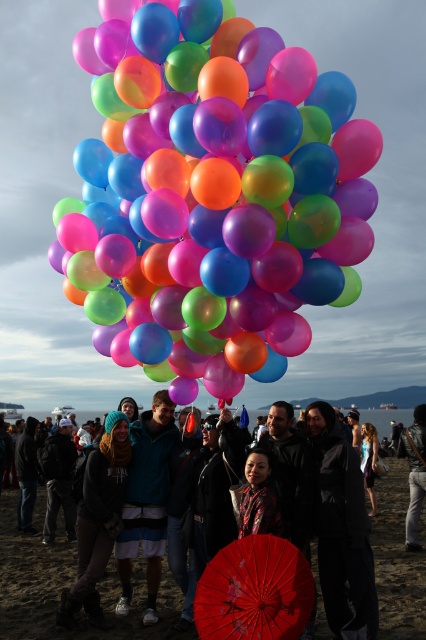
Question: Does red glossy umbrella at center come behind denim jacket at lower right?

Choices:
 (A) no
 (B) yes

Answer: (A)

Question: Which point is closer to the camera?

Choices:
 (A) denim jacket at lower right
 (B) red paper umbrella at center
 (C) matte black hoodie at center
 (D) red glossy umbrella at center

Answer: (D)

Question: Does black waterproof jacket at center appear on the left side of red glossy umbrella at center?

Choices:
 (A) yes
 (B) no

Answer: (B)

Question: Which object is closer to the camera taking this photo?

Choices:
 (A) translucent glossy balloons at center
 (B) denim jacket at lower right

Answer: (A)

Question: Does red glossy umbrella at center appear on the left side of matte black hoodie at center?

Choices:
 (A) no
 (B) yes

Answer: (A)

Question: Estimate the real-world distances between objects in this image. Which object is farther from the translucent glossy balloons at center?

Choices:
 (A) red paper umbrella at center
 (B) denim jacket at lower right
 (C) black waterproof jacket at center

Answer: (B)